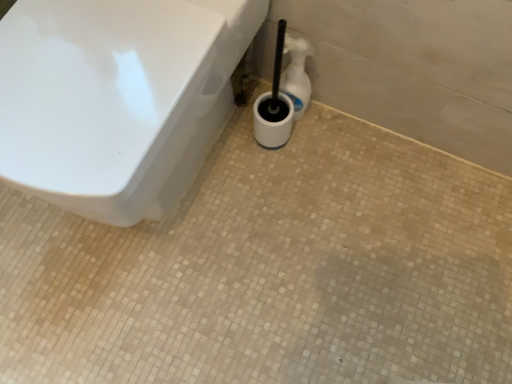
This screenshot has height=384, width=512. I want to click on white glossy toilet at upper left, so click(x=117, y=99).

Describe the element at coordinates (117, 99) in the screenshot. The height and width of the screenshot is (384, 512). I see `white glossy toilet at upper left` at that location.

What is the approximate width of white glossy toilet at upper left?

white glossy toilet at upper left is 25.36 inches in width.

The image size is (512, 384). Identify the location of white plastic bottle at center. (296, 75).

The width and height of the screenshot is (512, 384). What do you see at coordinates (296, 75) in the screenshot? I see `white plastic bottle at center` at bounding box center [296, 75].

You are a GUI agent. You are given a task and a screenshot of the screen. Output one action in this format:
    pyautogui.click(x=<x>, y=<y>)
    Task: Click on the white glossy toilet at upper left
    This screenshot has width=512, height=384.
    Given the screenshot: What is the action you would take?
    pyautogui.click(x=117, y=99)

Which is more to the right, white glossy toilet at upper left or white plastic bottle at center?

white plastic bottle at center.

Is white glossy toilet at upper left closer to the viewer compared to white plastic bottle at center?

Yes.

Considering the positions of points (101, 109) and (302, 105), is point (101, 109) closer to camera compared to point (302, 105)?

Yes, point (101, 109) is in front of point (302, 105).

From the image's perspective, is white glossy toilet at upper left on white plastic bottle at center?

Incorrect, from the image's perspective, white glossy toilet at upper left is lower than white plastic bottle at center.

From a real-world perspective, who is located higher, white glossy toilet at upper left or white plastic bottle at center?

white glossy toilet at upper left.

Consider the image. Does white glossy toilet at upper left have a lesser width compared to white plastic bottle at center?

Incorrect, the width of white glossy toilet at upper left is not less than that of white plastic bottle at center.

Considering the sizes of objects white glossy toilet at upper left and white plastic bottle at center in the image provided, who is taller, white glossy toilet at upper left or white plastic bottle at center?

white glossy toilet at upper left is taller.

Between white glossy toilet at upper left and white plastic bottle at center, which one has larger size?

white glossy toilet at upper left is bigger.

Looking at this image, is white glossy toilet at upper left completely or partially outside of white plastic bottle at center?

white glossy toilet at upper left is positioned outside white plastic bottle at center.

Is white glossy toilet at upper left next to white plastic bottle at center?

white glossy toilet at upper left is not next to white plastic bottle at center, and they're not touching.

Could you tell me if white glossy toilet at upper left is turned towards white plastic bottle at center?

No.

How different are the orientations of white glossy toilet at upper left and white plastic bottle at center in degrees?

0.313 degrees separate the facing orientations of white glossy toilet at upper left and white plastic bottle at center.

Where is `bottle behind the white glossy toilet at upper left`? bottle behind the white glossy toilet at upper left is located at coordinates (296, 75).

Which is more to the left, white plastic bottle at center or white glossy toilet at upper left?

From the viewer's perspective, white glossy toilet at upper left appears more on the left side.

Is white plastic bottle at center closer to camera compared to white glossy toilet at upper left?

That is False.

Considering the positions of points (297, 47) and (72, 4), is point (297, 47) farther from camera compared to point (72, 4)?

Yes.

From the image's perspective, which object appears higher, white plastic bottle at center or white glossy toilet at upper left?

From the image's view, white plastic bottle at center is above.

From a real-world perspective, which is physically below, white plastic bottle at center or white glossy toilet at upper left?

white plastic bottle at center is physically lower.

Does white plastic bottle at center have a lesser width compared to white glossy toilet at upper left?

Indeed, white plastic bottle at center has a lesser width compared to white glossy toilet at upper left.

Considering the sizes of objects white plastic bottle at center and white glossy toilet at upper left in the image provided, who is taller, white plastic bottle at center or white glossy toilet at upper left?

white glossy toilet at upper left is taller.

Considering the relative sizes of white plastic bottle at center and white glossy toilet at upper left in the image provided, is white plastic bottle at center smaller than white glossy toilet at upper left?

Indeed, white plastic bottle at center has a smaller size compared to white glossy toilet at upper left.

Do you think white plastic bottle at center is within white glossy toilet at upper left, or outside of it?

white plastic bottle at center is not inside white glossy toilet at upper left, it's outside.

Is white plastic bottle at center placed right next to white glossy toilet at upper left?

No, white plastic bottle at center is not in contact with white glossy toilet at upper left.

Is white plastic bottle at center aimed at white glossy toilet at upper left?

No, white plastic bottle at center does not turn towards white glossy toilet at upper left.

This screenshot has height=384, width=512. What are the coordinates of `bottle behind the white glossy toilet at upper left` in the screenshot? It's located at (296, 75).

Identify the location of bottle behind the white glossy toilet at upper left. (296, 75).

Image resolution: width=512 pixels, height=384 pixels. In order to click on toilet in front of the white plastic bottle at center in this screenshot , I will do 117,99.